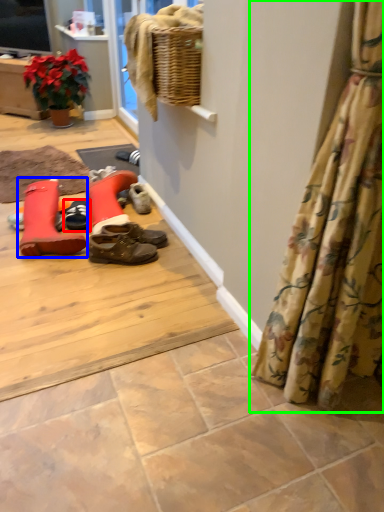
Question: Which object is the farthest from footwear (highlighted by a red box)? Choose among these: footwear (highlighted by a blue box) or curtain (highlighted by a green box).

Choices:
 (A) footwear
 (B) curtain

Answer: (B)